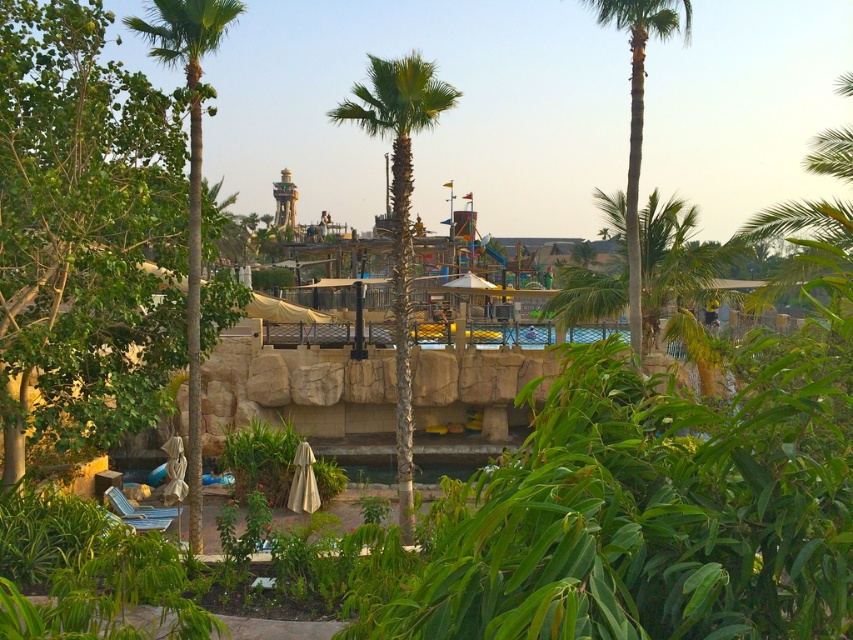
Can you confirm if green textured palm tree at center is thinner than green leafy palm tree at right?

No.

Which is in front, point (405, 211) or point (635, 177)?

Positioned in front is point (405, 211).

The height and width of the screenshot is (640, 853). What are the coordinates of `green textured palm tree at center` in the screenshot? It's located at (399, 212).

Measure the distance between green leafy tree at center and green textured palm tree at center.

green leafy tree at center is 21.22 feet from green textured palm tree at center.

Between green leafy tree at center and green textured palm tree at center, which one appears on the right side from the viewer's perspective?

Positioned to the right is green textured palm tree at center.

Is point (135, 225) behind point (407, 275)?

No, (135, 225) is in front of (407, 275).

Locate an element on the screen. green leafy tree at center is located at coordinates (83, 232).

Between green leafy palm tree at left and green leafy palm tree at right, which one is positioned lower?

green leafy palm tree at right

Is green leafy palm tree at left below green leafy palm tree at right?

No, green leafy palm tree at left is not below green leafy palm tree at right.

Between point (202, 19) and point (630, 16), which one is positioned in front?

Point (202, 19) is more forward.

Locate an element on the screen. green leafy palm tree at left is located at coordinates (190, 177).